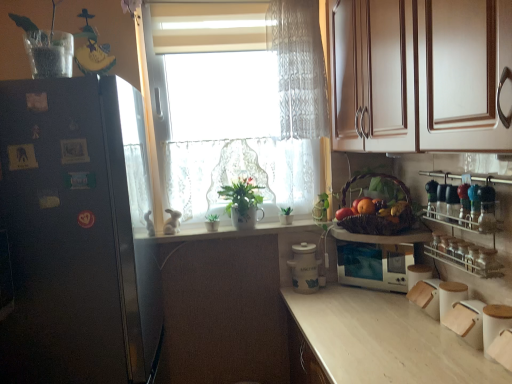
Locate an element on the screen. vacant area that lies between green matte houseplant at center, the third houseplant when ordered from right to left, and green matte houseplant at center, the 1th houseplant viewed from the right is located at coordinates (252, 227).